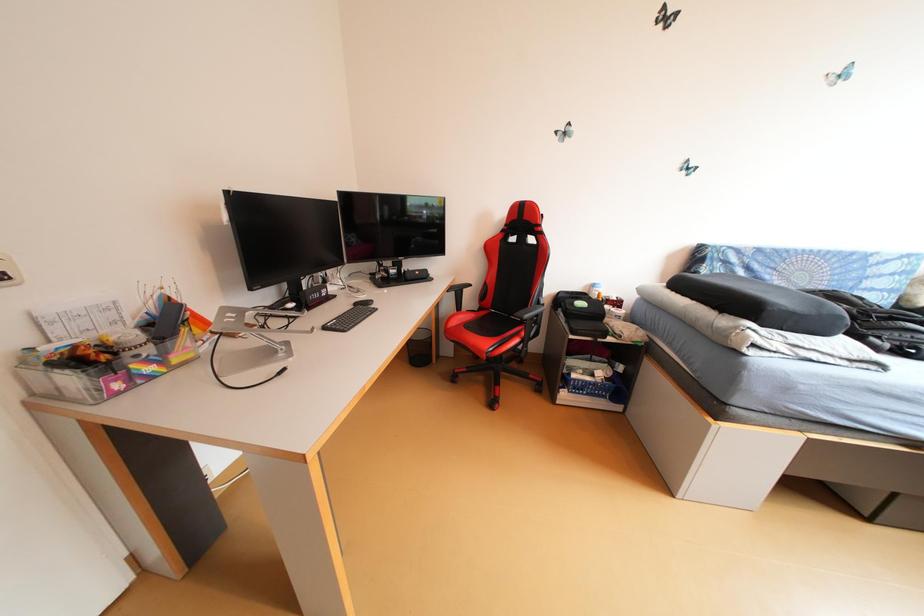
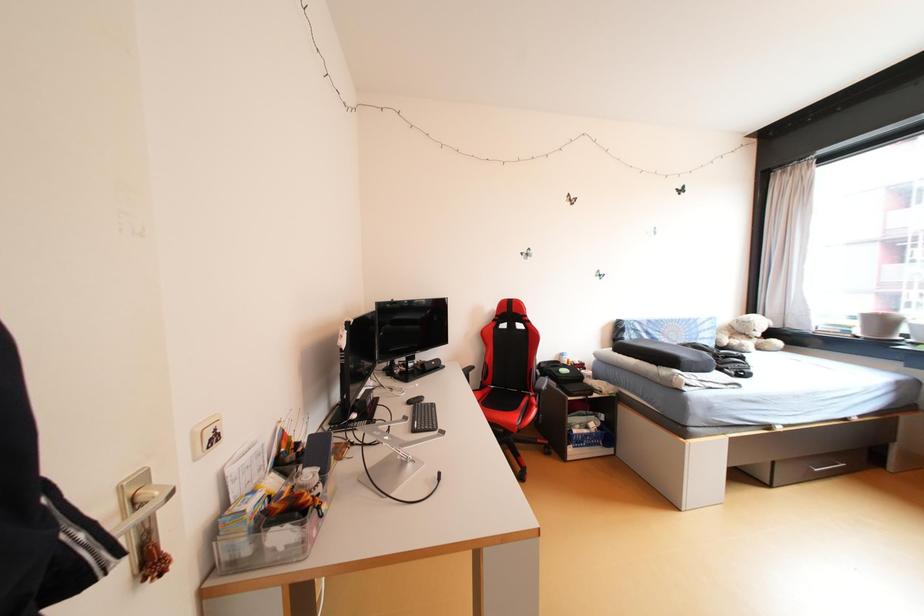
Question: Which direction would the cameraman need to move to produce the second image? Reply with the corresponding letter.

Choices:
 (A) Left
 (B) Right
 (C) Forward
 (D) Backward

Answer: (A)